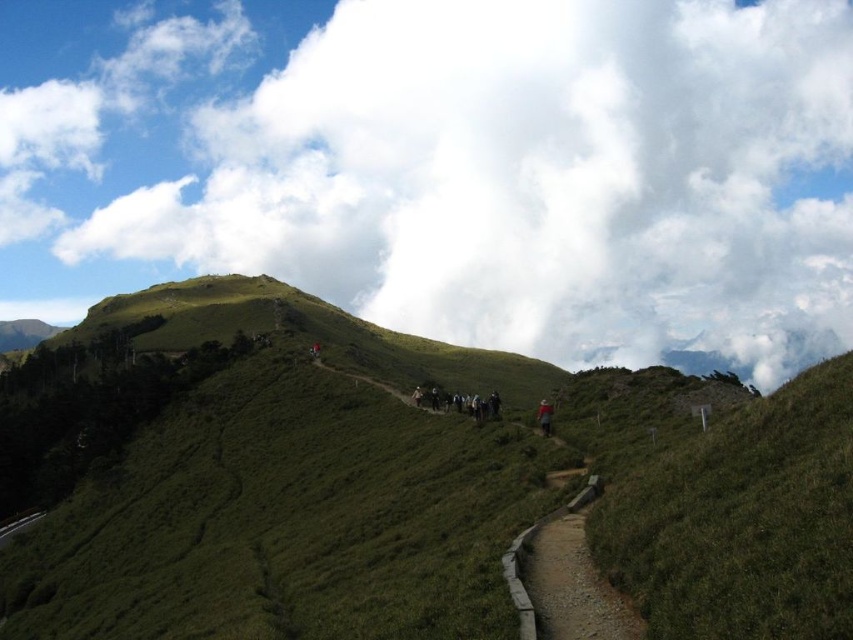
Between green grassy at upper right and red woolen hat at center, which one appears on the left side from the viewer's perspective?

red woolen hat at center is more to the left.

Can you confirm if green grassy at upper right is wider than red woolen hat at center?

Yes, green grassy at upper right is wider than red woolen hat at center.

Between point (728, 628) and point (548, 435), which one is positioned behind?

Point (548, 435)

In order to click on green grassy at upper right in this screenshot , I will do `click(744, 522)`.

Is white fluffy cloud at upper center below brown dirt path at center?

No, white fluffy cloud at upper center is not below brown dirt path at center.

I want to click on white fluffy cloud at upper center, so click(448, 164).

Locate an element on the screen. This screenshot has width=853, height=640. white fluffy cloud at upper center is located at coordinates (448, 164).

Who is higher up, white fluffy cloud at upper center or dark gray fabric backpacks at center?

Positioned higher is white fluffy cloud at upper center.

Who is more forward, (849, 225) or (477, 401)?

Point (477, 401)

Locate an element on the screen. The image size is (853, 640). white fluffy cloud at upper center is located at coordinates (448, 164).